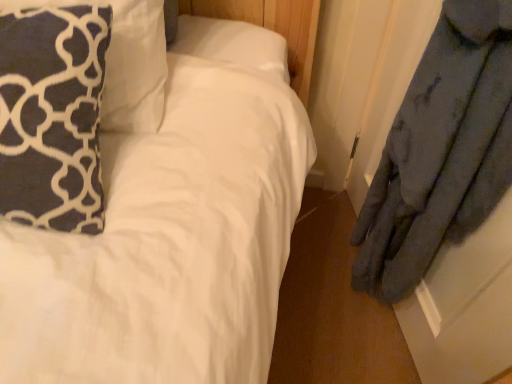
Locate an element on the screen. The height and width of the screenshot is (384, 512). dark blue fabric pillow at upper left, the first pillow in the top-to-bottom sequence is located at coordinates (128, 63).

What do you see at coordinates (128, 63) in the screenshot? I see `dark blue fabric pillow at upper left, arranged as the second pillow when ordered from the bottom` at bounding box center [128, 63].

Where is `dark blue plush pillow at upper left, arranged as the 2th pillow when viewed from the top`? This screenshot has width=512, height=384. dark blue plush pillow at upper left, arranged as the 2th pillow when viewed from the top is located at coordinates (52, 116).

Describe the element at coordinates (52, 116) in the screenshot. I see `dark blue plush pillow at upper left, which is counted as the first pillow, starting from the bottom` at that location.

What is the approximate width of dark blue plush pillow at upper left, arranged as the 2th pillow when viewed from the top?

The width of dark blue plush pillow at upper left, arranged as the 2th pillow when viewed from the top, is 10.38 inches.

In order to click on dark blue fabric pillow at upper left, the first pillow in the top-to-bottom sequence in this screenshot , I will do (x=128, y=63).

Considering the positions of objects dark blue plush pillow at upper left, arranged as the 2th pillow when viewed from the top, and dark blue fabric pillow at upper left, arranged as the second pillow when ordered from the bottom, in the image provided, who is more to the right, dark blue plush pillow at upper left, arranged as the 2th pillow when viewed from the top, or dark blue fabric pillow at upper left, arranged as the second pillow when ordered from the bottom,?

From the viewer's perspective, dark blue fabric pillow at upper left, arranged as the second pillow when ordered from the bottom, appears more on the right side.

Based on the photo, which object is further away from the camera, dark blue plush pillow at upper left, which is counted as the first pillow, starting from the bottom, or dark blue fabric pillow at upper left, the first pillow in the top-to-bottom sequence?

dark blue fabric pillow at upper left, the first pillow in the top-to-bottom sequence.

Is point (86, 103) closer or farther from the camera than point (134, 88)?

Point (86, 103) is positioned closer to the camera compared to point (134, 88).

From the image's perspective, which is above, dark blue plush pillow at upper left, which is counted as the first pillow, starting from the bottom, or dark blue fabric pillow at upper left, the first pillow in the top-to-bottom sequence?

dark blue fabric pillow at upper left, the first pillow in the top-to-bottom sequence.

Looking at this image, from a real-world perspective, is dark blue plush pillow at upper left, arranged as the 2th pillow when viewed from the top, physically above dark blue fabric pillow at upper left, arranged as the second pillow when ordered from the bottom?

Indeed, from a real-world perspective, dark blue plush pillow at upper left, arranged as the 2th pillow when viewed from the top, stands above dark blue fabric pillow at upper left, arranged as the second pillow when ordered from the bottom.

Considering the sizes of objects dark blue plush pillow at upper left, arranged as the 2th pillow when viewed from the top, and dark blue fabric pillow at upper left, arranged as the second pillow when ordered from the bottom, in the image provided, who is thinner, dark blue plush pillow at upper left, arranged as the 2th pillow when viewed from the top, or dark blue fabric pillow at upper left, arranged as the second pillow when ordered from the bottom,?

Thinner between the two is dark blue fabric pillow at upper left, arranged as the second pillow when ordered from the bottom.

Does dark blue plush pillow at upper left, arranged as the 2th pillow when viewed from the top, have a greater height compared to dark blue fabric pillow at upper left, the first pillow in the top-to-bottom sequence?

Incorrect, the height of dark blue plush pillow at upper left, arranged as the 2th pillow when viewed from the top, is not larger of that of dark blue fabric pillow at upper left, the first pillow in the top-to-bottom sequence.

Based on their sizes in the image, would you say dark blue plush pillow at upper left, which is counted as the first pillow, starting from the bottom, is bigger or smaller than dark blue fabric pillow at upper left, the first pillow in the top-to-bottom sequence?

In the image, dark blue plush pillow at upper left, which is counted as the first pillow, starting from the bottom, appears to be smaller than dark blue fabric pillow at upper left, the first pillow in the top-to-bottom sequence.

Would you say dark blue plush pillow at upper left, which is counted as the first pillow, starting from the bottom, is outside dark blue fabric pillow at upper left, arranged as the second pillow when ordered from the bottom?

Yes, dark blue plush pillow at upper left, which is counted as the first pillow, starting from the bottom, is outside of dark blue fabric pillow at upper left, arranged as the second pillow when ordered from the bottom.

Is dark blue plush pillow at upper left, arranged as the 2th pillow when viewed from the top, far away from dark blue fabric pillow at upper left, the first pillow in the top-to-bottom sequence?

dark blue plush pillow at upper left, arranged as the 2th pillow when viewed from the top, is actually quite close to dark blue fabric pillow at upper left, the first pillow in the top-to-bottom sequence.

Is dark blue plush pillow at upper left, arranged as the 2th pillow when viewed from the top, turned away from dark blue fabric pillow at upper left, arranged as the second pillow when ordered from the bottom?

That's right, dark blue plush pillow at upper left, arranged as the 2th pillow when viewed from the top, is facing away from dark blue fabric pillow at upper left, arranged as the second pillow when ordered from the bottom.

How different are the orientations of dark blue plush pillow at upper left, arranged as the 2th pillow when viewed from the top, and dark blue fabric pillow at upper left, the first pillow in the top-to-bottom sequence, in degrees?

0.577 degrees separate the facing orientations of dark blue plush pillow at upper left, arranged as the 2th pillow when viewed from the top, and dark blue fabric pillow at upper left, the first pillow in the top-to-bottom sequence.

Measure the distance from dark blue plush pillow at upper left, arranged as the 2th pillow when viewed from the top, to dark blue fabric pillow at upper left, the first pillow in the top-to-bottom sequence.

dark blue plush pillow at upper left, arranged as the 2th pillow when viewed from the top, and dark blue fabric pillow at upper left, the first pillow in the top-to-bottom sequence, are 4.36 inches apart.

Where is `pillow on the left of dark blue fabric pillow at upper left, the first pillow in the top-to-bottom sequence`? pillow on the left of dark blue fabric pillow at upper left, the first pillow in the top-to-bottom sequence is located at coordinates (52, 116).

Is dark blue fabric pillow at upper left, arranged as the second pillow when ordered from the bottom, to the left or to the right of dark blue plush pillow at upper left, arranged as the 2th pillow when viewed from the top, in the image?

Based on their positions, dark blue fabric pillow at upper left, arranged as the second pillow when ordered from the bottom, is located to the right of dark blue plush pillow at upper left, arranged as the 2th pillow when viewed from the top.

Considering the relative positions of dark blue fabric pillow at upper left, the first pillow in the top-to-bottom sequence, and dark blue plush pillow at upper left, arranged as the 2th pillow when viewed from the top, in the image provided, is dark blue fabric pillow at upper left, the first pillow in the top-to-bottom sequence, behind dark blue plush pillow at upper left, arranged as the 2th pillow when viewed from the top,?

That is True.

Does point (147, 51) come behind point (58, 178)?

Yes.

Based on the photo, from the image's perspective, which one is positioned higher, dark blue fabric pillow at upper left, the first pillow in the top-to-bottom sequence, or dark blue plush pillow at upper left, arranged as the 2th pillow when viewed from the top?

dark blue fabric pillow at upper left, the first pillow in the top-to-bottom sequence, from the image's perspective.

From a real-world perspective, is dark blue fabric pillow at upper left, arranged as the second pillow when ordered from the bottom, physically below dark blue plush pillow at upper left, which is counted as the first pillow, starting from the bottom?

Yes, from a real-world perspective, dark blue fabric pillow at upper left, arranged as the second pillow when ordered from the bottom, is under dark blue plush pillow at upper left, which is counted as the first pillow, starting from the bottom.

Is dark blue fabric pillow at upper left, arranged as the second pillow when ordered from the bottom, thinner than dark blue plush pillow at upper left, which is counted as the first pillow, starting from the bottom?

Indeed, dark blue fabric pillow at upper left, arranged as the second pillow when ordered from the bottom, has a lesser width compared to dark blue plush pillow at upper left, which is counted as the first pillow, starting from the bottom.

Is dark blue fabric pillow at upper left, the first pillow in the top-to-bottom sequence, taller or shorter than dark blue plush pillow at upper left, arranged as the 2th pillow when viewed from the top?

Considering their sizes, dark blue fabric pillow at upper left, the first pillow in the top-to-bottom sequence, has more height than dark blue plush pillow at upper left, arranged as the 2th pillow when viewed from the top.

Considering the sizes of objects dark blue fabric pillow at upper left, arranged as the second pillow when ordered from the bottom, and dark blue plush pillow at upper left, which is counted as the first pillow, starting from the bottom, in the image provided, who is smaller, dark blue fabric pillow at upper left, arranged as the second pillow when ordered from the bottom, or dark blue plush pillow at upper left, which is counted as the first pillow, starting from the bottom,?

Smaller between the two is dark blue plush pillow at upper left, which is counted as the first pillow, starting from the bottom.

Is dark blue fabric pillow at upper left, arranged as the second pillow when ordered from the bottom, not within dark blue plush pillow at upper left, arranged as the 2th pillow when viewed from the top?

Indeed, dark blue fabric pillow at upper left, arranged as the second pillow when ordered from the bottom, is completely outside dark blue plush pillow at upper left, arranged as the 2th pillow when viewed from the top.

Can you see dark blue fabric pillow at upper left, arranged as the second pillow when ordered from the bottom, touching dark blue plush pillow at upper left, arranged as the 2th pillow when viewed from the top?

They are not placed beside each other.

Is dark blue plush pillow at upper left, arranged as the 2th pillow when viewed from the top, at the back of dark blue fabric pillow at upper left, the first pillow in the top-to-bottom sequence?

Yes.

Can you tell me how much dark blue fabric pillow at upper left, arranged as the second pillow when ordered from the bottom, and dark blue plush pillow at upper left, arranged as the 2th pillow when viewed from the top, differ in facing direction?

The facing directions of dark blue fabric pillow at upper left, arranged as the second pillow when ordered from the bottom, and dark blue plush pillow at upper left, arranged as the 2th pillow when viewed from the top, are 0.577 degrees apart.

Identify the location of pillow lying behind the dark blue plush pillow at upper left, arranged as the 2th pillow when viewed from the top. Image resolution: width=512 pixels, height=384 pixels. (128, 63).

At what (x,y) coordinates should I click in order to perform the action: click on pillow above the dark blue fabric pillow at upper left, the first pillow in the top-to-bottom sequence (from a real-world perspective). Please return your answer as a coordinate pair (x, y). This screenshot has width=512, height=384. Looking at the image, I should click on (52, 116).

The height and width of the screenshot is (384, 512). Identify the location of pillow on the left of dark blue fabric pillow at upper left, the first pillow in the top-to-bottom sequence. (52, 116).